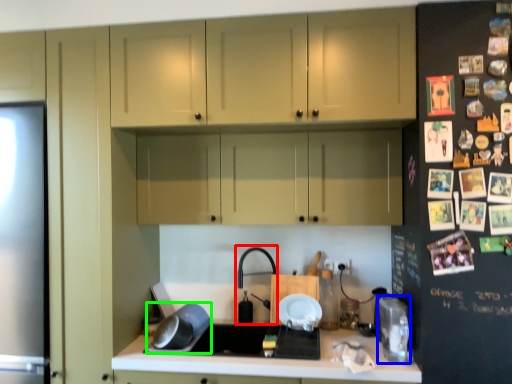
Question: Which object is positioned closest to faucet (highlighted by a red box)? Select from appliance (highlighted by a blue box) and appliance (highlighted by a green box).

Choices:
 (A) appliance
 (B) appliance

Answer: (B)